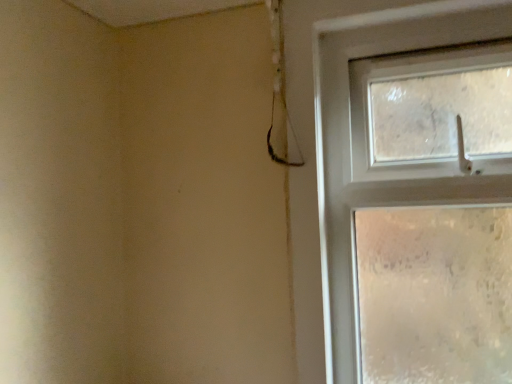
Measure the distance between point [472,36] and camera.

Point [472,36] and camera are 35.31 inches apart from each other.

Describe the element at coordinates (333, 140) in the screenshot. I see `white frosted glass window at upper right` at that location.

The height and width of the screenshot is (384, 512). In order to click on white frosted glass window at upper right in this screenshot , I will do `click(333, 140)`.

This screenshot has height=384, width=512. I want to click on white frosted glass window at upper right, so click(x=333, y=140).